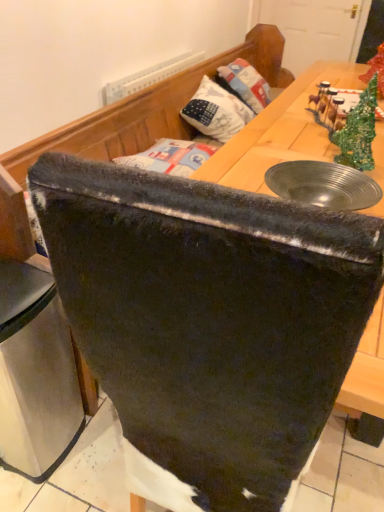
Question: Does velvet black chair at center have a lesser width compared to stainless steel trash can at lower left?

Choices:
 (A) yes
 (B) no

Answer: (B)

Question: Is velvet black chair at center next to stainless steel trash can at lower left?

Choices:
 (A) yes
 (B) no

Answer: (B)

Question: Considering the relative sizes of velvet black chair at center and stainless steel trash can at lower left in the image provided, is velvet black chair at center shorter than stainless steel trash can at lower left?

Choices:
 (A) no
 (B) yes

Answer: (A)

Question: Considering the relative sizes of velvet black chair at center and stainless steel trash can at lower left in the image provided, is velvet black chair at center wider than stainless steel trash can at lower left?

Choices:
 (A) yes
 (B) no

Answer: (A)

Question: Is velvet black chair at center taller than stainless steel trash can at lower left?

Choices:
 (A) yes
 (B) no

Answer: (A)

Question: Looking at their shapes, would you say velvet black chair at center is wider or thinner than stainless steel trash can at lower left?

Choices:
 (A) thin
 (B) wide

Answer: (B)

Question: Considering their positions, is velvet black chair at center located in front of or behind stainless steel trash can at lower left?

Choices:
 (A) behind
 (B) front

Answer: (B)

Question: From the image's perspective, is velvet black chair at center positioned above or below stainless steel trash can at lower left?

Choices:
 (A) above
 (B) below

Answer: (A)

Question: Considering the relative positions of velvet black chair at center and stainless steel trash can at lower left in the image provided, is velvet black chair at center to the left or to the right of stainless steel trash can at lower left?

Choices:
 (A) right
 (B) left

Answer: (A)

Question: Is stainless steel trash can at lower left situated inside velvet black chair at center or outside?

Choices:
 (A) outside
 (B) inside

Answer: (A)

Question: Considering the relative positions of stainless steel trash can at lower left and velvet black chair at center in the image provided, is stainless steel trash can at lower left to the left or to the right of velvet black chair at center?

Choices:
 (A) right
 (B) left

Answer: (B)

Question: From their relative heights in the image, would you say stainless steel trash can at lower left is taller or shorter than velvet black chair at center?

Choices:
 (A) tall
 (B) short

Answer: (B)

Question: Based on their sizes in the image, would you say stainless steel trash can at lower left is bigger or smaller than velvet black chair at center?

Choices:
 (A) small
 (B) big

Answer: (A)

Question: Considering the relative positions of velvet black chair at center and white fabric pillow at upper center in the image provided, is velvet black chair at center to the left or to the right of white fabric pillow at upper center?

Choices:
 (A) left
 (B) right

Answer: (A)

Question: Considering the positions of point (117, 103) and point (225, 136), is point (117, 103) closer or farther from the camera than point (225, 136)?

Choices:
 (A) closer
 (B) farther

Answer: (A)